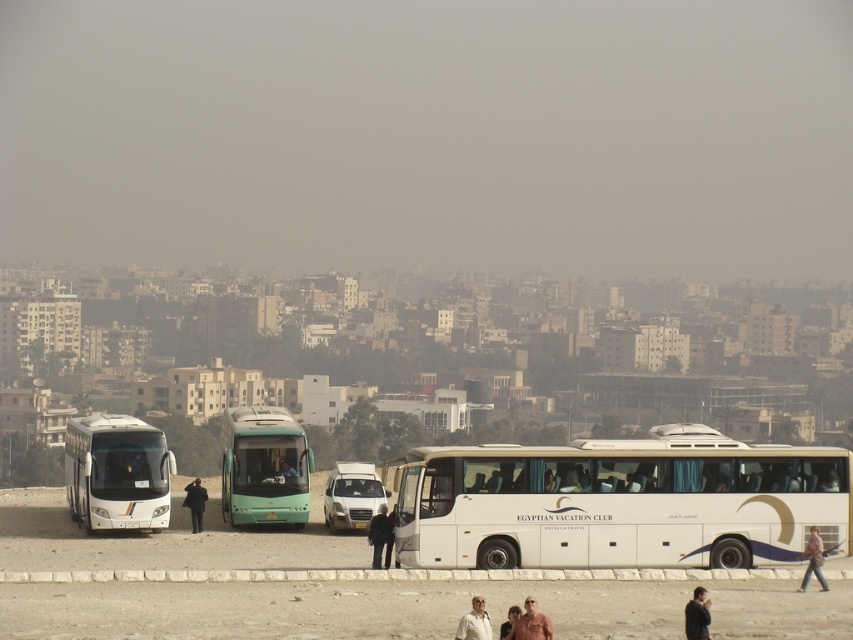
Does brown textured shirt at lower center have a greater height compared to light brown leather jacket at lower center?

No, brown textured shirt at lower center is not taller than light brown leather jacket at lower center.

What do you see at coordinates (532, 624) in the screenshot? I see `brown textured shirt at lower center` at bounding box center [532, 624].

Locate an element on the screen. The width and height of the screenshot is (853, 640). brown textured shirt at lower center is located at coordinates (532, 624).

Is white matte bus at center to the right of brown textured shirt at lower center from the viewer's perspective?

Yes, white matte bus at center is to the right of brown textured shirt at lower center.

This screenshot has width=853, height=640. Find the location of `white matte bus at center`. white matte bus at center is located at coordinates (619, 502).

Can you confirm if black fabric pants at center is wider than black fabric coat at center?

Incorrect, black fabric pants at center's width does not surpass black fabric coat at center's.

Is black fabric pants at center below black fabric coat at center?

No, black fabric pants at center is not below black fabric coat at center.

Which is in front, point (370, 561) or point (196, 512)?

Point (370, 561) is more forward.

This screenshot has width=853, height=640. Find the location of `black fabric pants at center`. black fabric pants at center is located at coordinates tap(379, 534).